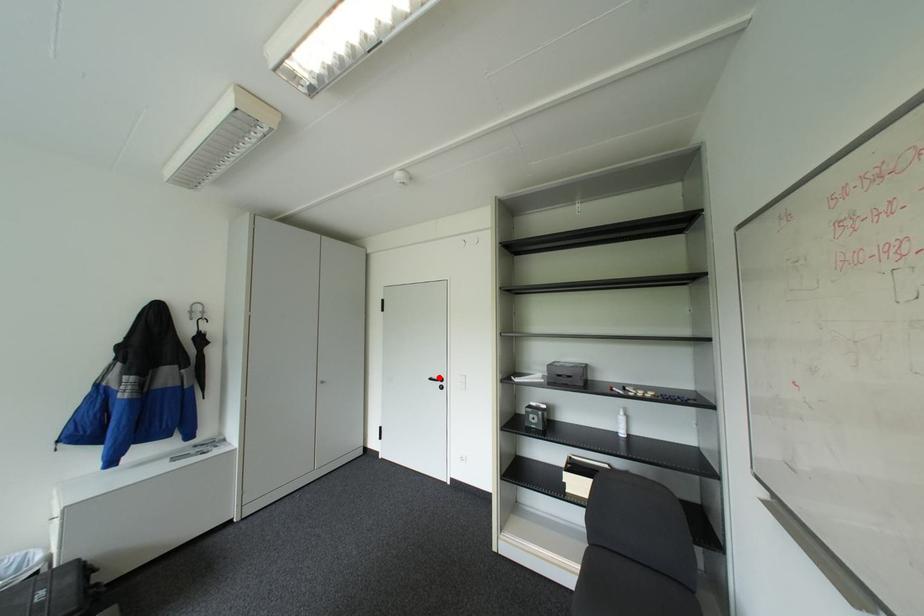
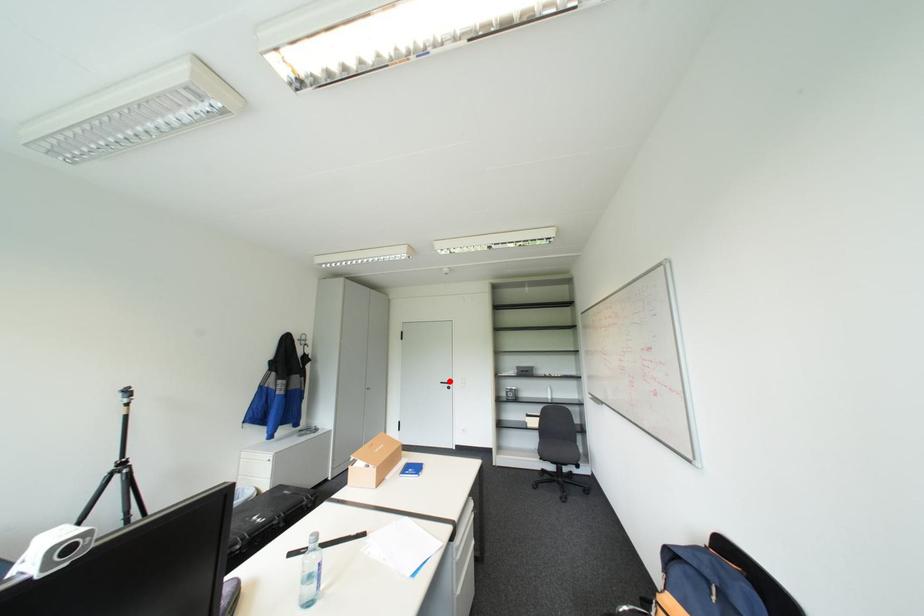
I am providing you with two images of the same scene from different viewpoints. A red point is marked on the first image and another point is marked on the second image. Do the highlighted points in image1 and image2 indicate the same real-world spot?

Yes